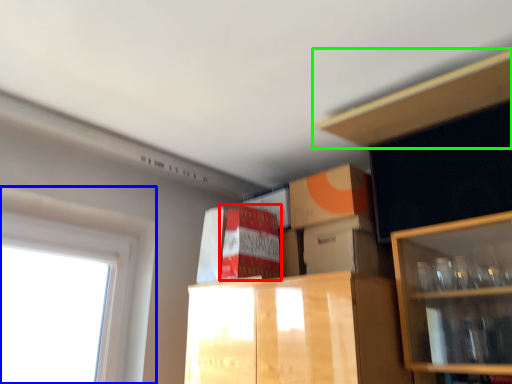
Question: Estimate the real-world distances between objects in this image. Which object is farther from cabinetry (highlighted by a red box), window (highlighted by a blue box) or cabinet (highlighted by a green box)?

Choices:
 (A) window
 (B) cabinet

Answer: (B)